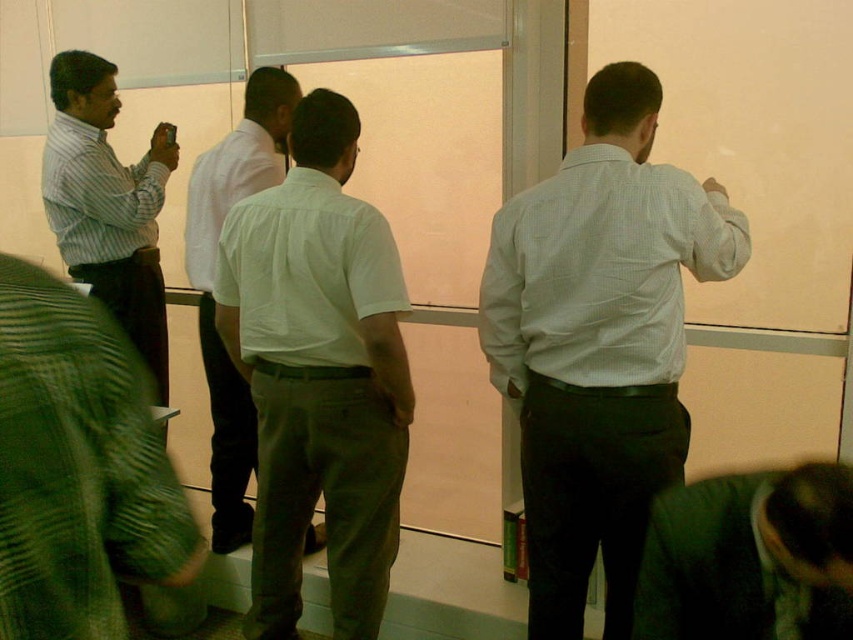
How distant is green textured shirt at lower left from white shirt at left?

The distance of green textured shirt at lower left from white shirt at left is 4.69 feet.

Between point (99, 401) and point (222, 426), which one is positioned in front?

Point (99, 401)

Between point (129, 440) and point (223, 497), which one is positioned behind?

The point (223, 497) is more distant.

The height and width of the screenshot is (640, 853). Identify the location of green textured shirt at lower left. (78, 467).

Does white checkered shirt at right have a smaller size compared to striped cotton shirt at left?

No.

Measure the distance between white checkered shirt at right and camera.

A distance of 1.71 meters exists between white checkered shirt at right and camera.

Which is in front, point (566, 310) or point (166, 378)?

Point (566, 310) is in front.

Locate an element on the screen. Image resolution: width=853 pixels, height=640 pixels. white checkered shirt at right is located at coordinates (599, 342).

Between white cotton shirt at center and dark green suit at lower right, which one is positioned lower?

Positioned lower is dark green suit at lower right.

Can you confirm if white cotton shirt at center is smaller than dark green suit at lower right?

Actually, white cotton shirt at center might be larger than dark green suit at lower right.

What do you see at coordinates (318, 372) in the screenshot?
I see `white cotton shirt at center` at bounding box center [318, 372].

You are a GUI agent. You are given a task and a screenshot of the screen. Output one action in this format:
    pyautogui.click(x=<x>, y=<y>)
    Task: Click on the white cotton shirt at center
    The width and height of the screenshot is (853, 640).
    Given the screenshot: What is the action you would take?
    [x=318, y=372]